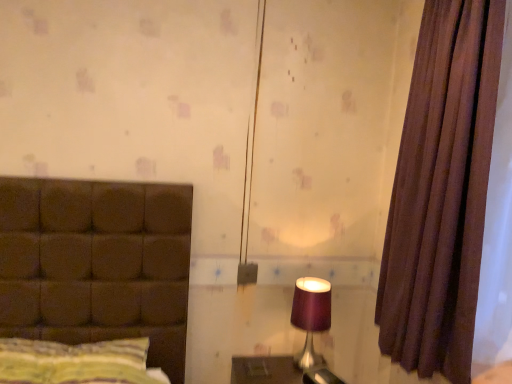
Question: In the image, is striped fabric pillow at left positioned in front of or behind brown fabric curtain at right?

Choices:
 (A) front
 (B) behind

Answer: (B)

Question: Does point (10, 372) appear closer or farther from the camera than point (462, 364)?

Choices:
 (A) closer
 (B) farther

Answer: (B)

Question: Which is nearer to the purple fabric lampshade at right?

Choices:
 (A) brown fabric curtain at right
 (B) striped fabric pillow at left

Answer: (A)

Question: Considering the real-world distances, which object is closest to the purple fabric lampshade at right?

Choices:
 (A) striped fabric pillow at left
 (B) brown fabric curtain at right

Answer: (B)